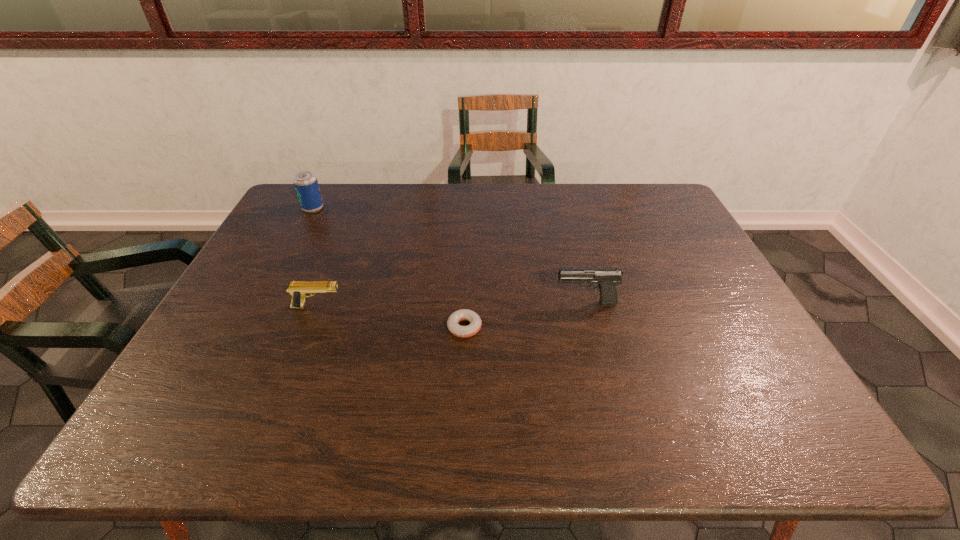
Where is `vacant region between the rightmost object and the third object from right to left`? The image size is (960, 540). vacant region between the rightmost object and the third object from right to left is located at coordinates (451, 305).

Where is `object that stands as the third closest to the taller pistol`? The image size is (960, 540). object that stands as the third closest to the taller pistol is located at coordinates (305, 182).

Find the location of `object identified as the closest to the shortest object`. object identified as the closest to the shortest object is located at coordinates (608, 278).

Locate an element on the screen. Image resolution: width=960 pixels, height=540 pixels. free region that satisfies the following two spatial constraints: 1. at the barrel of the second object from right to left; 2. on the left side of the shorter pistol is located at coordinates click(x=309, y=327).

Image resolution: width=960 pixels, height=540 pixels. What are the coordinates of `free space in the image that satisfies the following two spatial constraints: 1. at the barrel of the second object from right to left; 2. on the left side of the left pistol` in the screenshot? It's located at (309, 327).

This screenshot has width=960, height=540. What are the coordinates of `vacant region that satisfies the following two spatial constraints: 1. on the front side of the nearest object; 2. on the left side of the beer can` in the screenshot? It's located at (250, 327).